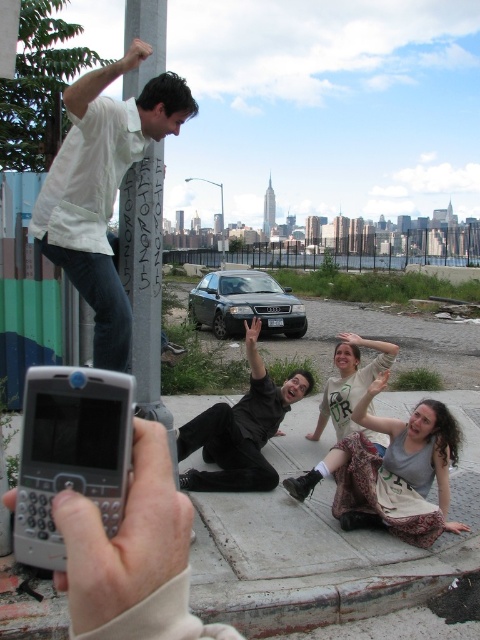
You are a photographer standing at the waterfront and want to take a photo of the black matte suit at center and the white painted metal pole at upper left. Which object is closer to you?

The white painted metal pole at upper left is closer to the viewer than the black matte suit at center.